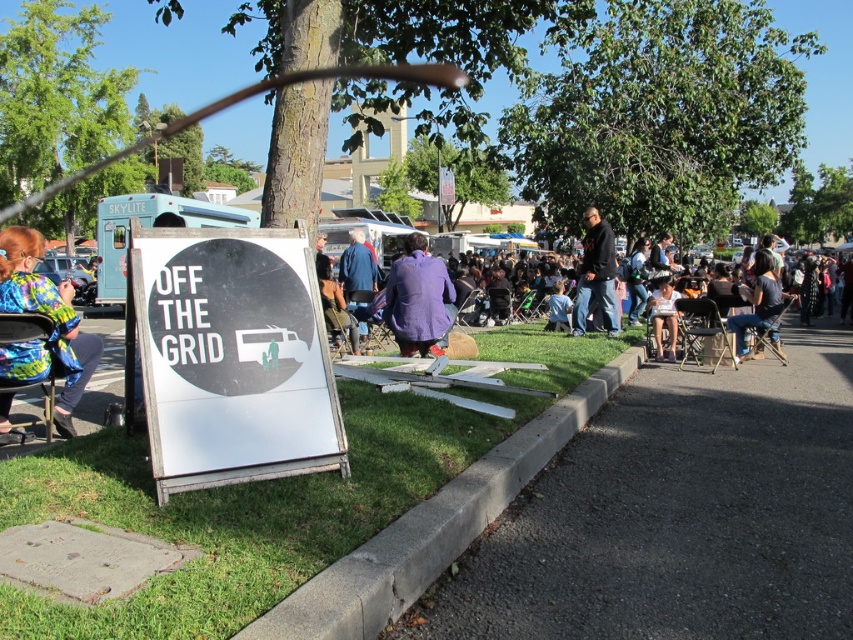
Can you confirm if purple fabric jacket at center is wider than white cotton shirt at center?

Yes.

Identify the location of purple fabric jacket at center. (363, 230).

You are a GUI agent. You are given a task and a screenshot of the screen. Output one action in this format:
    pyautogui.click(x=<x>, y=<y>)
    Task: Click on the purple fabric jacket at center
    The image size is (853, 640).
    Given the screenshot: What is the action you would take?
    pyautogui.click(x=363, y=230)

The image size is (853, 640). In order to click on gray concrete curb at lower center in this screenshot , I will do `click(434, 525)`.

Is point (432, 541) farther from viewer compared to point (352, 228)?

That is False.

Describe the element at coordinates (434, 525) in the screenshot. The height and width of the screenshot is (640, 853). I see `gray concrete curb at lower center` at that location.

At what (x,y) coordinates should I click in order to perform the action: click on gray concrete curb at lower center. Please return your answer as a coordinate pair (x, y). This screenshot has height=640, width=853. Looking at the image, I should click on (434, 525).

Who is positioned more to the left, multicolored fabric jacket at left or black matte jacket at upper center?

Positioned to the left is multicolored fabric jacket at left.

Which of these two, multicolored fabric jacket at left or black matte jacket at upper center, stands shorter?

Standing shorter between the two is multicolored fabric jacket at left.

Describe the element at coordinates (53, 323) in the screenshot. I see `multicolored fabric jacket at left` at that location.

Image resolution: width=853 pixels, height=640 pixels. Identify the location of multicolored fabric jacket at left. (53, 323).